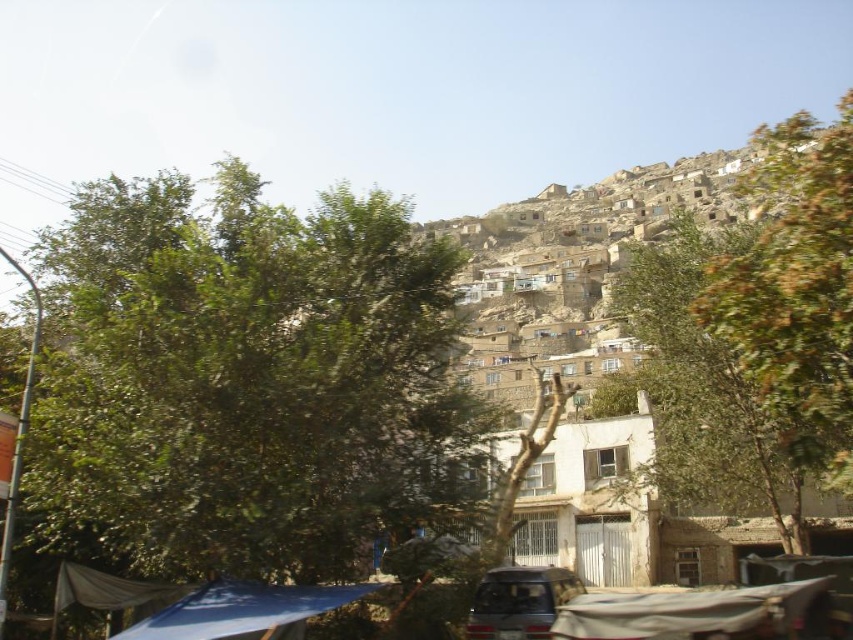
Between green leafy tree at center and green leafy tree at upper center, which one appears on the right side from the viewer's perspective?

From the viewer's perspective, green leafy tree at upper center appears more on the right side.

Is point (263, 497) positioned before point (660, 474)?

Yes, it is.

The width and height of the screenshot is (853, 640). Identify the location of green leafy tree at center. (245, 381).

Does green leafy tree at upper center have a greater height compared to metallic gray car at lower center?

Yes.

Between green leafy tree at upper center and metallic gray car at lower center, which one is positioned lower?

metallic gray car at lower center is below.

Who is more forward, (747, 444) or (505, 637)?

Point (505, 637)

Find the location of a particular element. green leafy tree at upper center is located at coordinates pos(706,390).

Between beige fabric canopy at lower right and metallic gray car at lower center, which one is positioned higher?

beige fabric canopy at lower right

Is beige fabric canopy at lower right closer to the viewer compared to metallic gray car at lower center?

Yes.

Which is in front, point (683, 605) or point (553, 589)?

Positioned in front is point (683, 605).

Find the location of `beige fabric canopy at lower right`. beige fabric canopy at lower right is located at coordinates (706, 612).